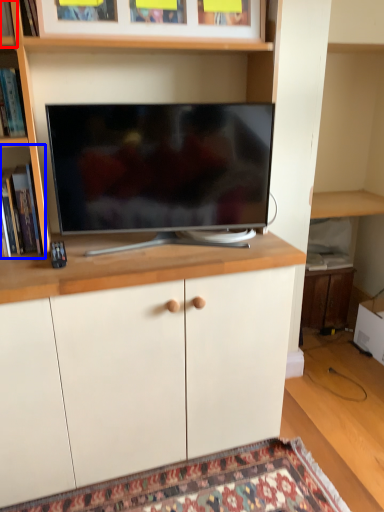
Question: Which object appears closest to the camera in this image, shelf (highlighted by a red box) or shelf (highlighted by a blue box)?

Choices:
 (A) shelf
 (B) shelf

Answer: (A)